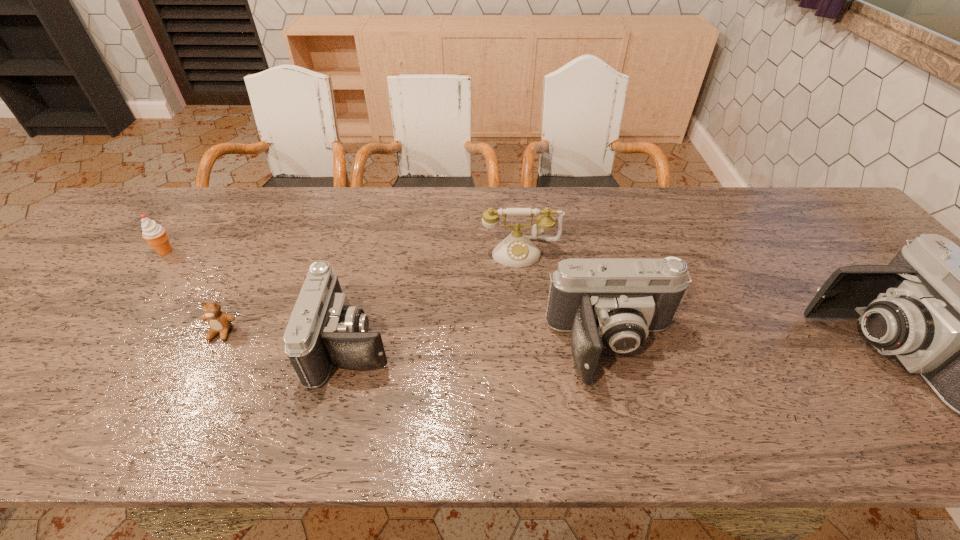
This screenshot has width=960, height=540. Identify the location of the leftmost camera. (324, 330).

You are a GUI agent. You are given a task and a screenshot of the screen. Output one action in this format:
    pyautogui.click(x=<x>, y=<y>)
    Task: Click on the shortest camera
    Image resolution: width=960 pixels, height=540 pixels.
    Given the screenshot: What is the action you would take?
    pyautogui.click(x=324, y=330)

Locate an element on the screen. the second camera from right to left is located at coordinates (614, 303).

Image resolution: width=960 pixels, height=540 pixels. I want to click on the second shortest camera, so click(x=614, y=303).

At what (x,y) coordinates should I click in order to perform the action: click on icecream. Please return your answer as a coordinate pair (x, y). Looking at the image, I should click on (155, 235).

You are a GUI agent. You are given a task and a screenshot of the screen. Output one action in this format:
    pyautogui.click(x=<x>, y=<y>)
    Task: Click on the telephone
    Image resolution: width=960 pixels, height=540 pixels.
    Given the screenshot: What is the action you would take?
    pyautogui.click(x=516, y=250)

The height and width of the screenshot is (540, 960). Identify the location of teddy bear. (219, 322).

Locate an element on the screen. The width and height of the screenshot is (960, 540). the shortest object is located at coordinates (219, 322).

Where is `vacant space situated at the front of the leftmost camera with an open lens cover`? vacant space situated at the front of the leftmost camera with an open lens cover is located at coordinates (441, 343).

Find the location of a particular element. The height and width of the screenshot is (540, 960). vacant space situated on the right of the leftmost object is located at coordinates (254, 251).